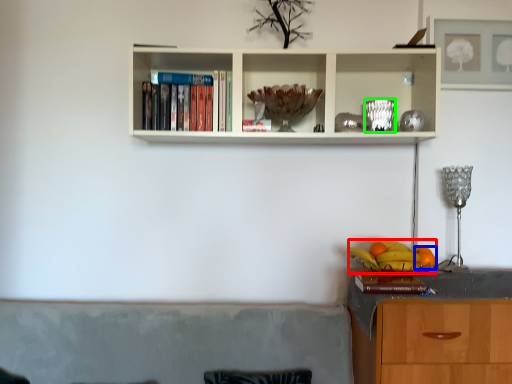
Question: Which is farther away from fruit (highlighted by a red box)? orange (highlighted by a blue box) or glass vase (highlighted by a green box)?

Choices:
 (A) orange
 (B) glass vase

Answer: (B)